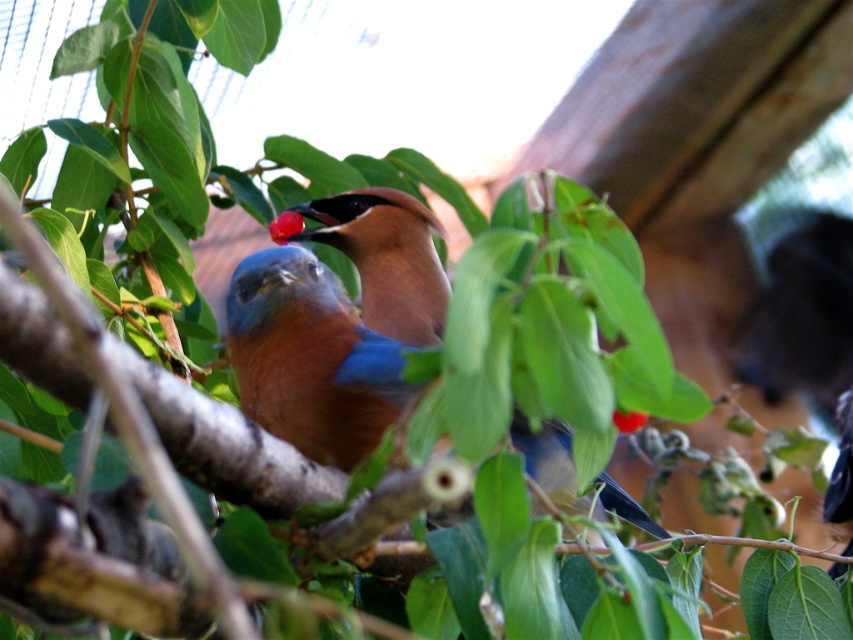
Question: Which object is farther from the camera taking this photo?

Choices:
 (A) blue glossy bird at center
 (B) red matte cherry at center

Answer: (B)

Question: Which of the following is the closest to the observer?

Choices:
 (A) blue glossy bird at center
 (B) red matte cherry at center

Answer: (A)

Question: Can you confirm if blue glossy bird at center is positioned above red matte cherry at center?

Choices:
 (A) no
 (B) yes

Answer: (A)

Question: Can you confirm if blue glossy bird at center is positioned to the right of glossy red berry at center?

Choices:
 (A) no
 (B) yes

Answer: (A)

Question: Among these points, which one is farthest from the camera?

Choices:
 (A) (634, 417)
 (B) (271, 232)

Answer: (B)

Question: Can you confirm if blue glossy bird at center is positioned to the left of glossy red berry at center?

Choices:
 (A) no
 (B) yes

Answer: (B)